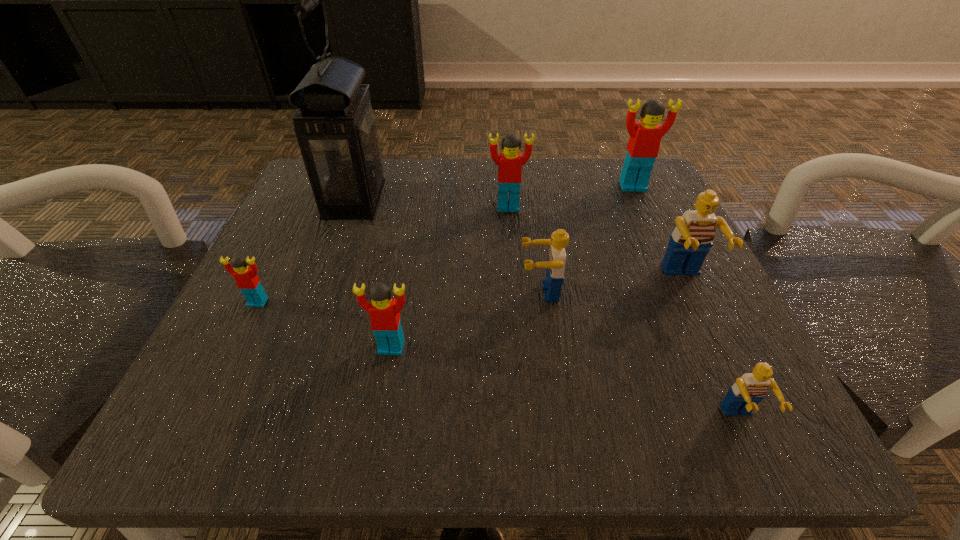
What are the coordinates of `red Lego that is the third nearest to the second farthest red Lego` in the screenshot? It's located at click(x=247, y=280).

Identify which red Lego is located as the third nearest to the second biggest blue Lego. Please provide its 2D coordinates. Your answer should be formatted as a tuple, i.e. [(x, y)], where the tuple contains the x and y coordinates of a point satisfying the conditions above.

[(645, 136)]

Identify the location of the closest blue Lego relative to the leftmost Lego. (555, 264).

Identify which blue Lego is the closest to the third red Lego from right to left. Please provide its 2D coordinates. Your answer should be formatted as a tuple, i.e. [(x, y)], where the tuple contains the x and y coordinates of a point satisfying the conditions above.

[(555, 264)]

Where is `free space in the image that satisfies the following two spatial constraints: 1. on the face of the second smallest blue Lego; 2. on the face of the leftmost Lego`? free space in the image that satisfies the following two spatial constraints: 1. on the face of the second smallest blue Lego; 2. on the face of the leftmost Lego is located at coordinates (541, 302).

The image size is (960, 540). In order to click on free point that satisfies the following two spatial constraints: 1. on the face of the biggest blue Lego; 2. on the face of the second smallest blue Lego in this screenshot , I will do `click(690, 292)`.